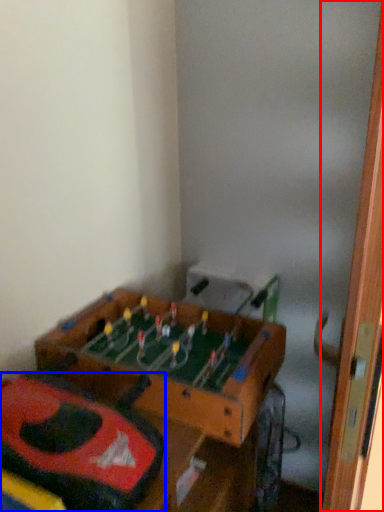
Question: Which object appears closest to the camera in this image, door (highlighted by a red box) or kit (highlighted by a blue box)?

Choices:
 (A) door
 (B) kit

Answer: (A)